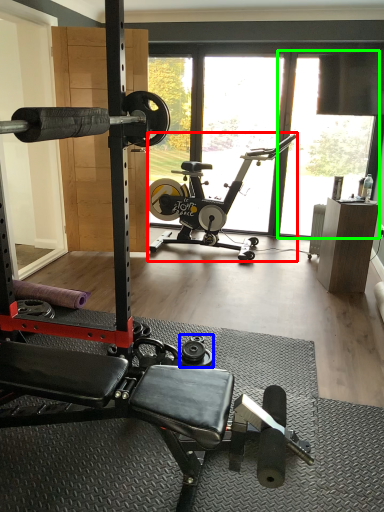
Question: Estimate the real-world distances between objects in this image. Which object is closer to stationary bicycle (highlighted by a red box), dumbbell (highlighted by a blue box) or window screen (highlighted by a green box)?

Choices:
 (A) dumbbell
 (B) window screen

Answer: (B)